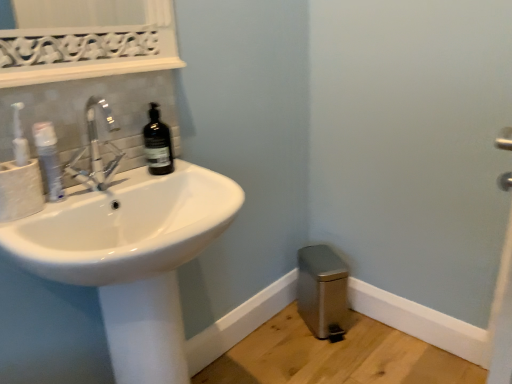
Question: Is matte white toilet paper at left thinner than white glossy mouthwash at left?

Choices:
 (A) no
 (B) yes

Answer: (A)

Question: Considering the relative sizes of matte white toilet paper at left and white glossy mouthwash at left in the image provided, is matte white toilet paper at left wider than white glossy mouthwash at left?

Choices:
 (A) no
 (B) yes

Answer: (B)

Question: Considering the relative sizes of matte white toilet paper at left and white glossy mouthwash at left in the image provided, is matte white toilet paper at left taller than white glossy mouthwash at left?

Choices:
 (A) yes
 (B) no

Answer: (B)

Question: Is matte white toilet paper at left positioned far away from white glossy mouthwash at left?

Choices:
 (A) yes
 (B) no

Answer: (B)

Question: Is matte white toilet paper at left in contact with white glossy mouthwash at left?

Choices:
 (A) no
 (B) yes

Answer: (B)

Question: Based on their sizes in the image, would you say black glass bottle at upper left is bigger or smaller than white glossy sink at left?

Choices:
 (A) small
 (B) big

Answer: (A)

Question: From a real-world perspective, relative to white glossy sink at left, is black glass bottle at upper left vertically above or below?

Choices:
 (A) above
 (B) below

Answer: (A)

Question: Is black glass bottle at upper left taller or shorter than white glossy sink at left?

Choices:
 (A) tall
 (B) short

Answer: (B)

Question: Is black glass bottle at upper left inside the boundaries of white glossy sink at left, or outside?

Choices:
 (A) outside
 (B) inside

Answer: (A)

Question: Considering the positions of black glass bottle at upper left and white glossy mouthwash at left in the image, is black glass bottle at upper left wider or thinner than white glossy mouthwash at left?

Choices:
 (A) thin
 (B) wide

Answer: (B)

Question: Considering the positions of black glass bottle at upper left and white glossy mouthwash at left in the image, is black glass bottle at upper left taller or shorter than white glossy mouthwash at left?

Choices:
 (A) tall
 (B) short

Answer: (A)

Question: Would you say black glass bottle at upper left is inside or outside white glossy mouthwash at left?

Choices:
 (A) outside
 (B) inside

Answer: (A)

Question: Is black glass bottle at upper left bigger or smaller than white glossy mouthwash at left?

Choices:
 (A) small
 (B) big

Answer: (B)

Question: In terms of height, does matte white toilet paper at left look taller or shorter compared to black glass bottle at upper left?

Choices:
 (A) tall
 (B) short

Answer: (B)

Question: Considering the positions of point (12, 198) and point (155, 122), is point (12, 198) closer or farther from the camera than point (155, 122)?

Choices:
 (A) closer
 (B) farther

Answer: (A)